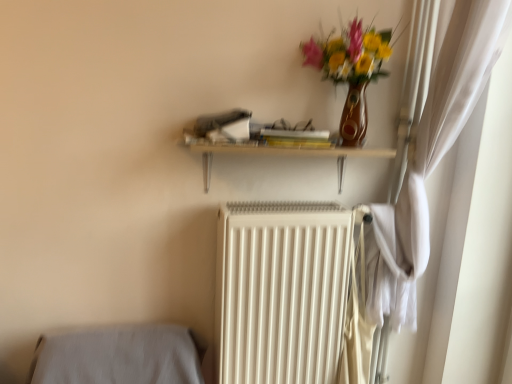
Where is `free space above white matte radiator at center (from a real-world perspective)`? This screenshot has width=512, height=384. free space above white matte radiator at center (from a real-world perspective) is located at coordinates (295, 204).